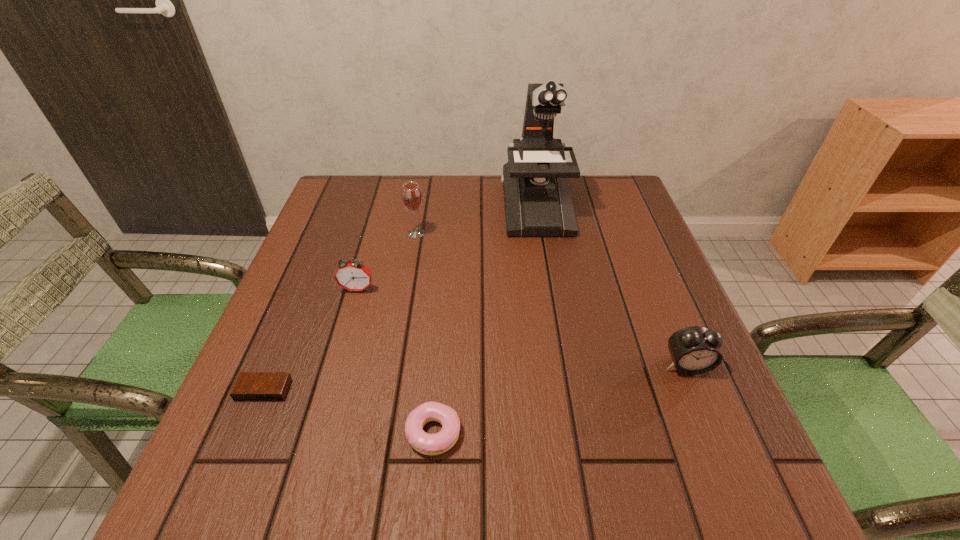
Identify the location of object located in the right edge section of the desktop. (695, 350).

In the image, there is a desktop. Where is `vacant space at the far edge`? The image size is (960, 540). vacant space at the far edge is located at coordinates coord(429,217).

In the image, there is a desktop. Where is `vacant area at the near edge`? vacant area at the near edge is located at coordinates coord(323,478).

This screenshot has width=960, height=540. Identify the location of vacant space at the left edge. (353, 254).

Find the location of a particular element. This screenshot has width=960, height=540. vacant space at the right edge of the desktop is located at coordinates (642, 265).

Find the location of a particular element. The width and height of the screenshot is (960, 540). blank space at the near left corner is located at coordinates (223, 516).

Locate an element on the screen. The height and width of the screenshot is (540, 960). free region at the far right corner is located at coordinates (595, 218).

What are the coordinates of `vacant space in between the second alarm clock from left to right and the doughnut` in the screenshot? It's located at (396, 361).

You are a GUI agent. You are given a task and a screenshot of the screen. Output one action in this format:
    pyautogui.click(x=<x>, y=<y>)
    Task: Click on the free space between the fourth farthest object and the microscope
    This screenshot has width=960, height=540.
    Given the screenshot: What is the action you would take?
    pyautogui.click(x=611, y=286)

The height and width of the screenshot is (540, 960). I want to click on vacant area between the rightmost alarm clock and the doughnut, so click(x=560, y=399).